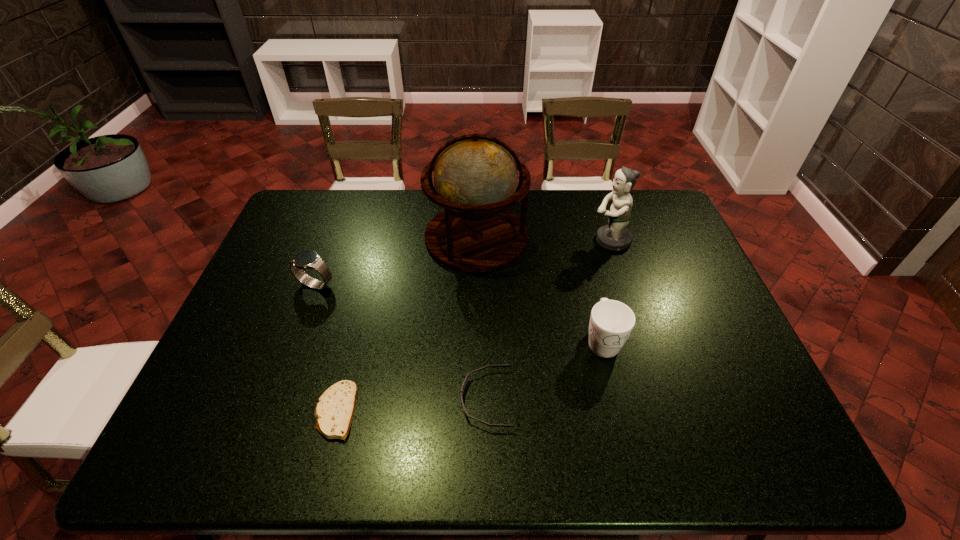
Point out which object is positioned as the nearest to the globe. Please provide its 2D coordinates. Your answer should be formatted as a tuple, i.e. [(x, y)], where the tuple contains the x and y coordinates of a point satisfying the conditions above.

[(615, 236)]